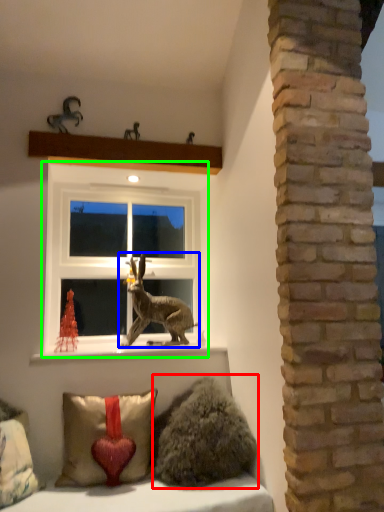
Question: Based on their relative distances, which object is nearer to animal (highlighted by a red box)? Choose from animal (highlighted by a blue box) and window (highlighted by a green box).

Choices:
 (A) animal
 (B) window

Answer: (A)